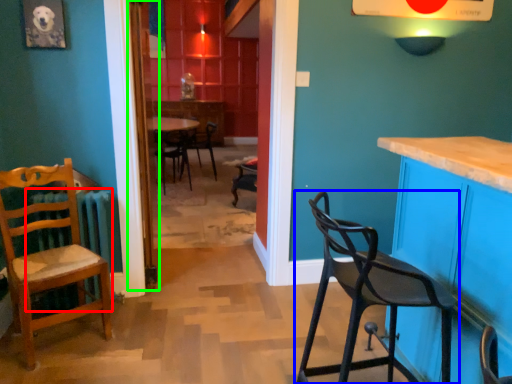
Question: Which object is positioned closest to radiator (highlighted by a red box)? Select from chair (highlighted by a blue box) and door (highlighted by a green box).

Choices:
 (A) chair
 (B) door

Answer: (B)